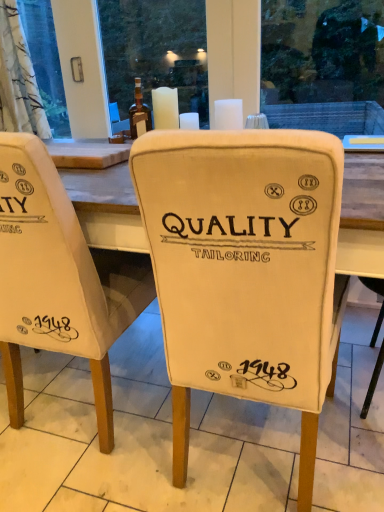
Question: Relative to white wax candle at upper center, arranged as the 2th candle when viewed from the right, is white fabric chair at center in front or behind?

Choices:
 (A) behind
 (B) front

Answer: (B)

Question: Based on their positions, is white fabric chair at center located to the left or right of white wax candle at upper center, arranged as the 2th candle when viewed from the right?

Choices:
 (A) left
 (B) right

Answer: (A)

Question: Which of these objects is positioned farthest from the white matte candle at upper center, arranged as the first candle when viewed from the right?

Choices:
 (A) white wax candle at upper center, arranged as the 2th candle when viewed from the right
 (B) white fabric chair at center
 (C) white fabric chair at center, placed as the 2th chair when sorted from left to right
 (D) translucent glass bottle at center
 (E) white fabric chair at center, the 1th chair positioned from the left

Answer: (B)

Question: Which object is the farthest from the white fabric chair at center?

Choices:
 (A) white fabric chair at center, the 1th chair positioned from the left
 (B) white fabric chair at center, placed as the 2th chair when sorted from left to right
 (C) white wax candle at upper center, arranged as the 2th candle when viewed from the right
 (D) translucent glass bottle at center
 (E) white matte candle at upper center, arranged as the first candle when viewed from the right

Answer: (D)